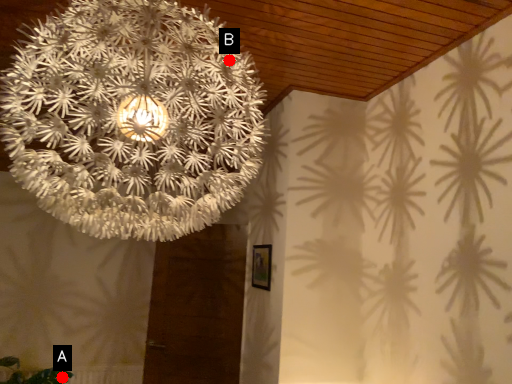
Question: Two points are circled on the image, labeled by A and B beside each circle. Which point is further to the camera?

Choices:
 (A) A is further
 (B) B is further

Answer: (A)